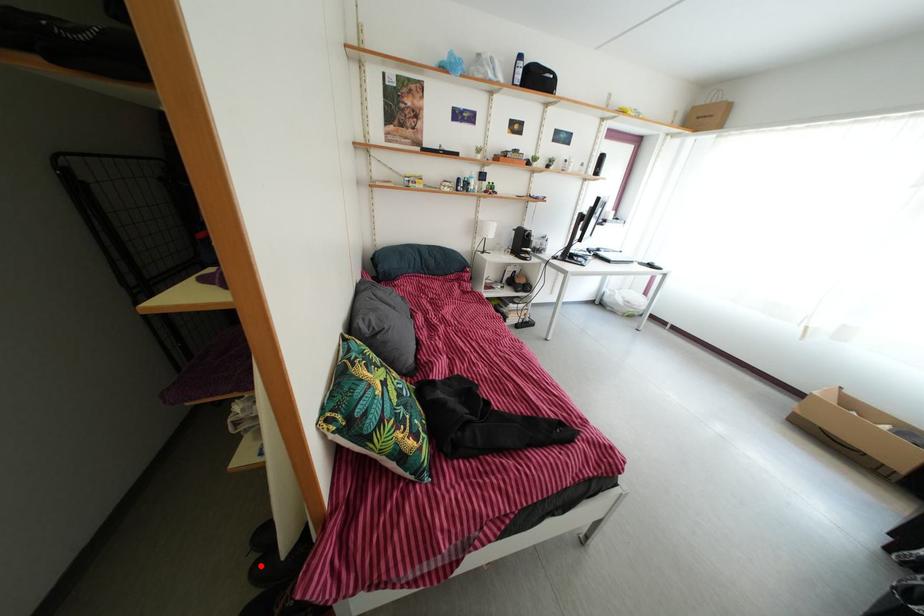
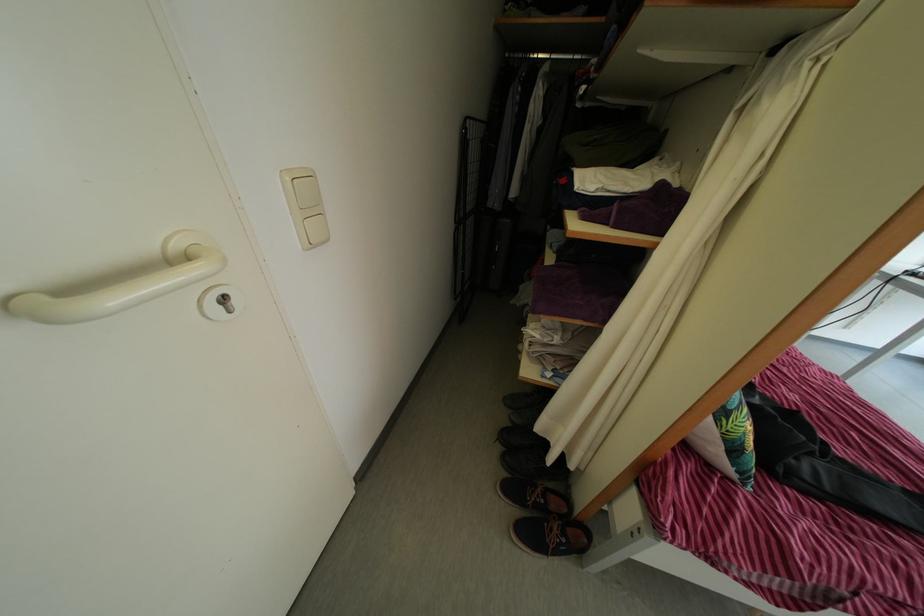
Question: A red point is marked in image1. In image2, is the corresponding 3D point closer to the camera or farther? Reply with the corresponding letter.

Choices:
 (A) The corresponding 3D point is closer.
 (B) The corresponding 3D point is farther.

Answer: (B)